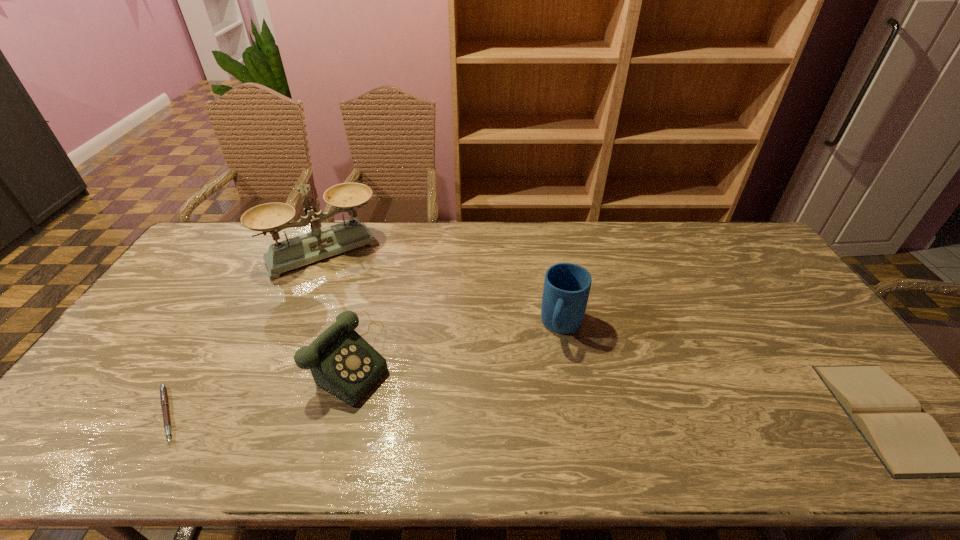
Identify the location of pen. This screenshot has width=960, height=540. (163, 390).

This screenshot has height=540, width=960. What are the coordinates of `mug` in the screenshot? It's located at pos(566,289).

Image resolution: width=960 pixels, height=540 pixels. What are the coordinates of `the fourth object from left to right` in the screenshot? It's located at (566, 289).

At what (x,y) coordinates should I click in order to perform the action: click on the third tallest object. Please return your answer as a coordinate pair (x, y). This screenshot has width=960, height=540. Looking at the image, I should click on (342, 363).

Locate an element on the screen. This screenshot has width=960, height=540. the tallest object is located at coordinates (318, 244).

Where is `the farthest object`? This screenshot has height=540, width=960. the farthest object is located at coordinates pyautogui.click(x=318, y=244).

This screenshot has height=540, width=960. I want to click on free spot located at the nib of the pen, so click(x=324, y=414).

The width and height of the screenshot is (960, 540). What are the coordinates of `vacant region located on the side of the fourth object from left to right with the handle` in the screenshot? It's located at (549, 372).

I want to click on free location located 0.170m on the side of the fourth object from left to right with the handle, so point(541,396).

Image resolution: width=960 pixels, height=540 pixels. What are the coordinates of `free space located 0.160m on the side of the fourth object from left to right with the handle` in the screenshot? It's located at (542, 393).